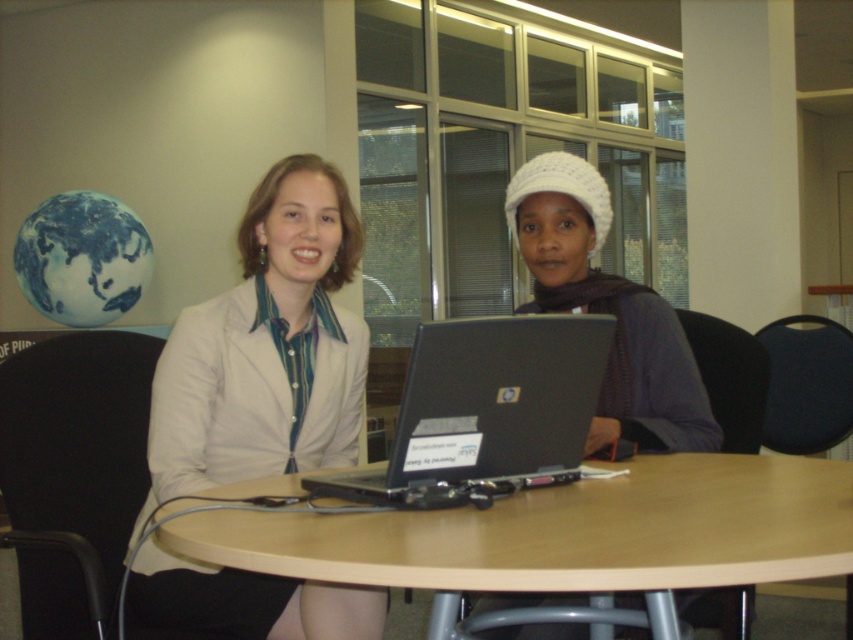
Is matte white blazer at center below black matte laptop at center?

Actually, matte white blazer at center is above black matte laptop at center.

Which is behind, point (152, 564) or point (573, 461)?

Positioned behind is point (152, 564).

Between point (200, 612) and point (550, 328), which one is positioned behind?

Point (200, 612)

Locate an element on the screen. matte white blazer at center is located at coordinates (265, 348).

Based on the photo, who is more forward, (807, 467) or (171, 404)?

Point (171, 404) is in front.

Does point (775, 534) come in front of point (281, 205)?

Yes, point (775, 534) is in front of point (281, 205).

Where is `wooden at center`? The height and width of the screenshot is (640, 853). wooden at center is located at coordinates (566, 534).

Can you confirm if wooden at center is wider than black matte laptop at center?

Indeed, wooden at center has a greater width compared to black matte laptop at center.

Is wooden at center above black matte laptop at center?

No, wooden at center is not above black matte laptop at center.

Locate an element on the screen. Image resolution: width=853 pixels, height=640 pixels. wooden at center is located at coordinates (566, 534).